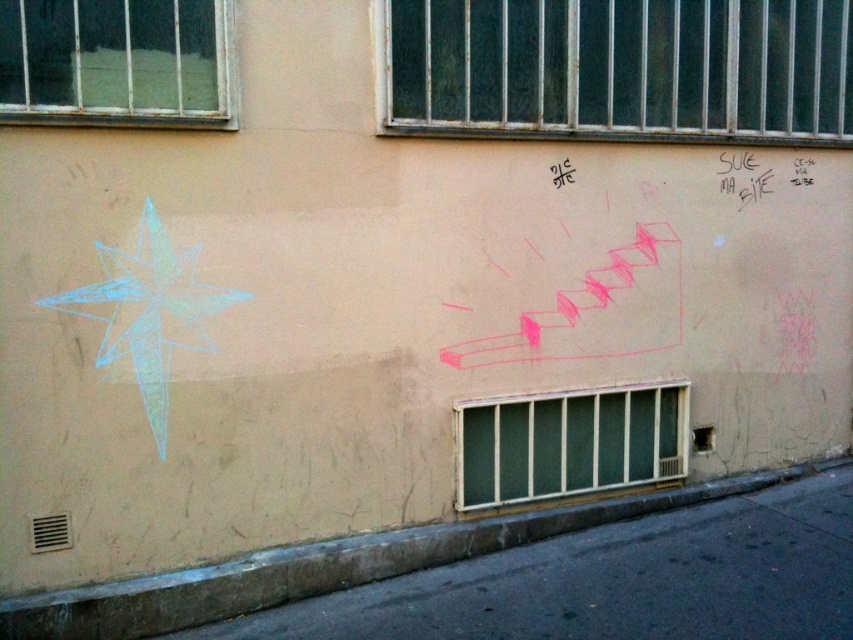
Is blue chalk star at upper left bigger than black chalk writing at upper right?

Yes.

Is blue chalk star at upper left to the left of black chalk writing at upper right from the viewer's perspective?

Correct, you'll find blue chalk star at upper left to the left of black chalk writing at upper right.

Locate an element on the screen. blue chalk star at upper left is located at coordinates (148, 310).

Is point (67, 298) positioned in front of point (746, 173)?

Yes, it is in front of point (746, 173).

Does point (190, 337) come behind point (730, 172)?

No, (190, 337) is closer to viewer.

This screenshot has width=853, height=640. I want to click on blue chalk star at upper left, so click(148, 310).

Which is in front, point (737, 160) or point (795, 182)?

Positioned in front is point (737, 160).

Does point (741, 196) come farther from viewer compared to point (798, 164)?

No.

You are a GUI agent. You are given a task and a screenshot of the screen. Output one action in this format:
    pyautogui.click(x=<x>, y=<y>)
    Task: Click on the black chalk graffiti at upper right
    The height and width of the screenshot is (640, 853).
    Given the screenshot: What is the action you would take?
    coord(743,177)